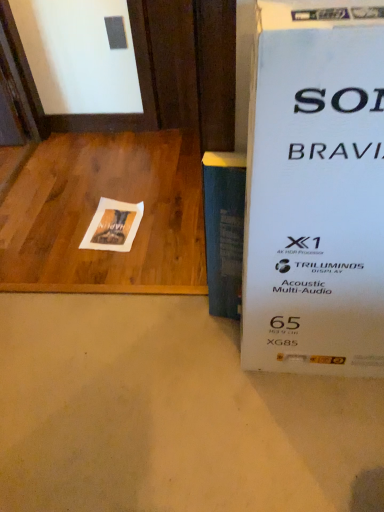
Question: Is wooden at left outside of blue matte book at center?

Choices:
 (A) yes
 (B) no

Answer: (A)

Question: Can you confirm if wooden at left is taller than blue matte book at center?

Choices:
 (A) yes
 (B) no

Answer: (B)

Question: Can you confirm if wooden at left is bigger than blue matte book at center?

Choices:
 (A) no
 (B) yes

Answer: (B)

Question: Is wooden at left positioned with its back to blue matte book at center?

Choices:
 (A) no
 (B) yes

Answer: (A)

Question: From the image's perspective, is wooden at left under blue matte book at center?

Choices:
 (A) no
 (B) yes

Answer: (A)

Question: Is point (208, 282) positioned closer to the camera than point (173, 280)?

Choices:
 (A) closer
 (B) farther

Answer: (A)

Question: From a real-world perspective, is blue matte book at center physically located above or below wooden at left?

Choices:
 (A) above
 (B) below

Answer: (A)

Question: Choose the correct answer: Is blue matte book at center inside wooden at left or outside it?

Choices:
 (A) inside
 (B) outside

Answer: (B)

Question: Is blue matte book at center bigger or smaller than wooden at left?

Choices:
 (A) big
 (B) small

Answer: (B)

Question: Is wooden at left wider or thinner than blue matte book at center?

Choices:
 (A) thin
 (B) wide

Answer: (B)

Question: From the image's perspective, is wooden at left positioned above or below blue matte book at center?

Choices:
 (A) below
 (B) above

Answer: (B)

Question: In terms of height, does wooden at left look taller or shorter compared to blue matte book at center?

Choices:
 (A) tall
 (B) short

Answer: (B)

Question: Considering the relative positions of wooden at left and blue matte book at center in the image provided, is wooden at left to the left or to the right of blue matte book at center?

Choices:
 (A) left
 (B) right

Answer: (A)

Question: From a real-world perspective, is white paper at center physically located above or below blue matte book at center?

Choices:
 (A) above
 (B) below

Answer: (B)

Question: Looking at the image, does white paper at center seem bigger or smaller compared to blue matte book at center?

Choices:
 (A) big
 (B) small

Answer: (B)